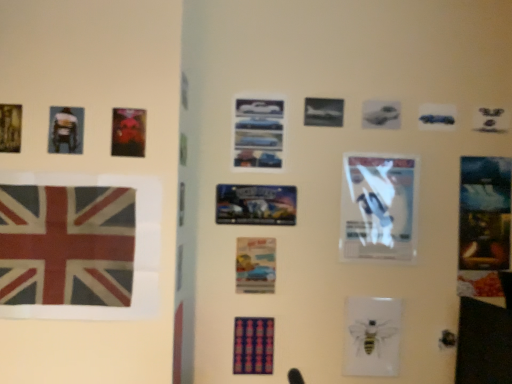
Question: Does metallic gold poster at upper left, which appears as the 6th poster when viewed from the back, appear on the left side of metallic silver poster at center, which is the 3th poster from bottom to top?

Choices:
 (A) yes
 (B) no

Answer: (A)

Question: Is metallic gold poster at upper left, which appears as the 6th poster when viewed from the back, aimed at metallic silver poster at center, which appears as the 4th poster when viewed from the back?

Choices:
 (A) yes
 (B) no

Answer: (B)

Question: Can you confirm if metallic gold poster at upper left, which appears as the second poster when viewed from the top, is thinner than metallic silver poster at center, which is the fifth poster from left to right?

Choices:
 (A) yes
 (B) no

Answer: (B)

Question: Is metallic silver poster at center, which is the fourth poster from top to bottom, located within metallic gold poster at upper left, which appears as the 6th poster when viewed from the back?

Choices:
 (A) yes
 (B) no

Answer: (B)

Question: Is metallic gold poster at upper left, the fifth poster from the bottom, closer to camera compared to metallic silver poster at center, which is the fifth poster from left to right?

Choices:
 (A) no
 (B) yes

Answer: (B)

Question: Does metallic gold poster at upper left, which appears as the 6th poster when viewed from the back, have a smaller size compared to metallic silver poster at center, which is the 3th poster from bottom to top?

Choices:
 (A) no
 (B) yes

Answer: (B)

Question: Can you confirm if textured fabric flag at left is wider than watercolor paper poster at center, which is the third poster in right-to-left order?

Choices:
 (A) no
 (B) yes

Answer: (B)

Question: Is the depth of textured fabric flag at left greater than that of watercolor paper poster at center, which is counted as the 5th poster, starting from the top?

Choices:
 (A) yes
 (B) no

Answer: (B)

Question: Does textured fabric flag at left come in front of watercolor paper poster at center, positioned as the 1th poster in back-to-front order?

Choices:
 (A) yes
 (B) no

Answer: (A)

Question: Is textured fabric flag at left in contact with watercolor paper poster at center, which is counted as the 5th poster, starting from the top?

Choices:
 (A) yes
 (B) no

Answer: (B)

Question: Considering the relative sizes of textured fabric flag at left and watercolor paper poster at center, which is counted as the 5th poster, starting from the top, in the image provided, is textured fabric flag at left thinner than watercolor paper poster at center, which is counted as the 5th poster, starting from the top,?

Choices:
 (A) yes
 (B) no

Answer: (B)

Question: Is textured fabric flag at left not near watercolor paper poster at center, which is counted as the 5th poster, starting from the top?

Choices:
 (A) no
 (B) yes

Answer: (A)

Question: Is textured fabric flag at left turned away from metallic blue cars at center, which appears as the fifth poster when viewed from the front?

Choices:
 (A) no
 (B) yes

Answer: (A)